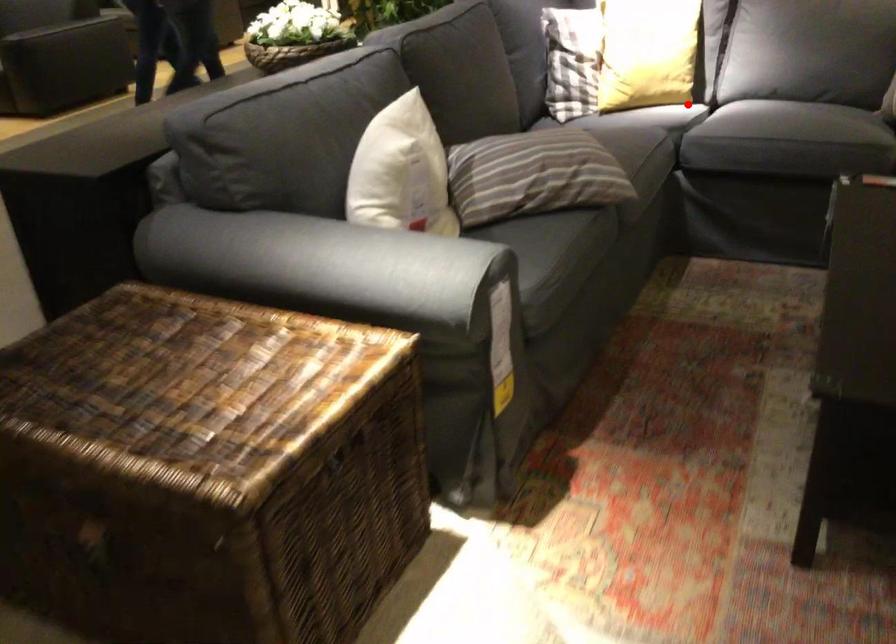
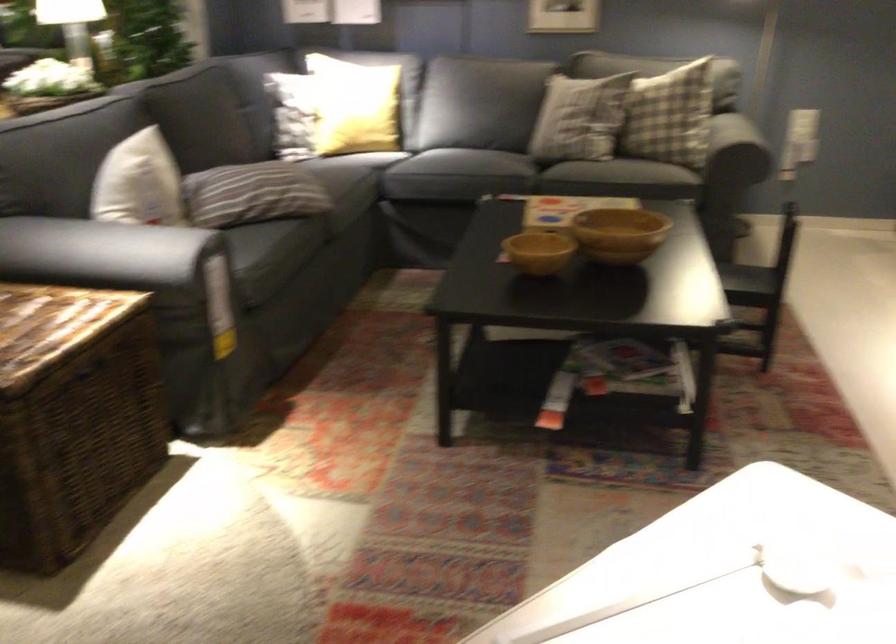
Find the pixel in the second image that matches the highlighted location in the first image.

(386, 149)